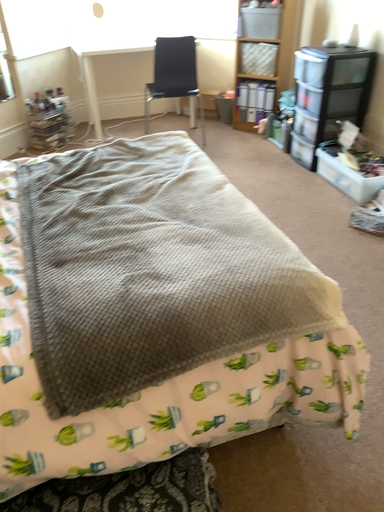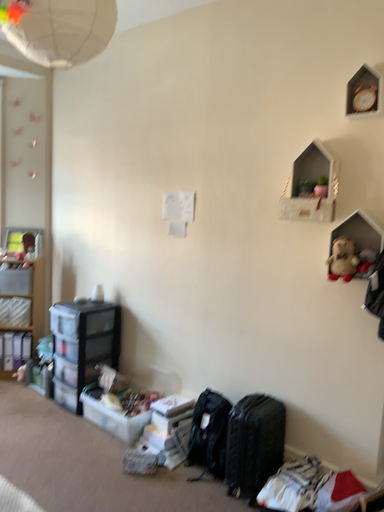
Question: Which way did the camera rotate in the video?

Choices:
 (A) rotated right
 (B) rotated left

Answer: (A)